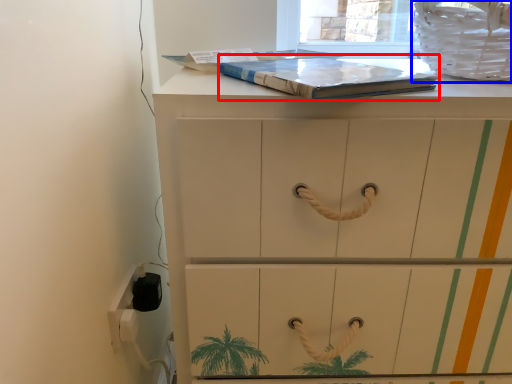
Question: Among these objects, which one is farthest to the camera, paperback book (highlighted by a red box) or laundry basket (highlighted by a blue box)?

Choices:
 (A) paperback book
 (B) laundry basket

Answer: (B)